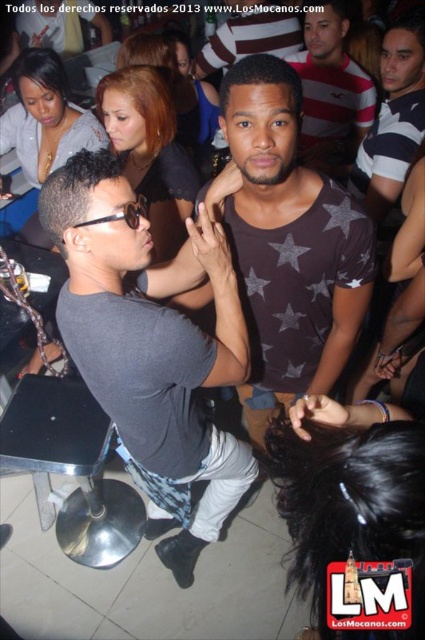
Question: Among these points, which one is farthest from the camera?

Choices:
 (A) pos(365,92)
 (B) pos(396,44)
 (C) pos(339,289)
 (D) pos(240,339)

Answer: (A)

Question: Considering the relative positions of gray matte t-shirt at center and striped cotton shirt at upper right in the image provided, where is gray matte t-shirt at center located with respect to striped cotton shirt at upper right?

Choices:
 (A) below
 (B) above

Answer: (A)

Question: Which object is the closest to the dark gray star-patterned shirt at center?

Choices:
 (A) striped cotton shirt at upper right
 (B) gray matte t-shirt at center
 (C) gray striped shirt at center

Answer: (B)

Question: Which of the following is the farthest from the observer?

Choices:
 (A) gray striped shirt at center
 (B) striped cotton shirt at upper right
 (C) gray matte t-shirt at center

Answer: (A)

Question: Is gray matte t-shirt at center in front of dark gray star-patterned shirt at center?

Choices:
 (A) no
 (B) yes

Answer: (B)

Question: Does gray matte t-shirt at center have a greater width compared to striped cotton shirt at upper right?

Choices:
 (A) yes
 (B) no

Answer: (A)